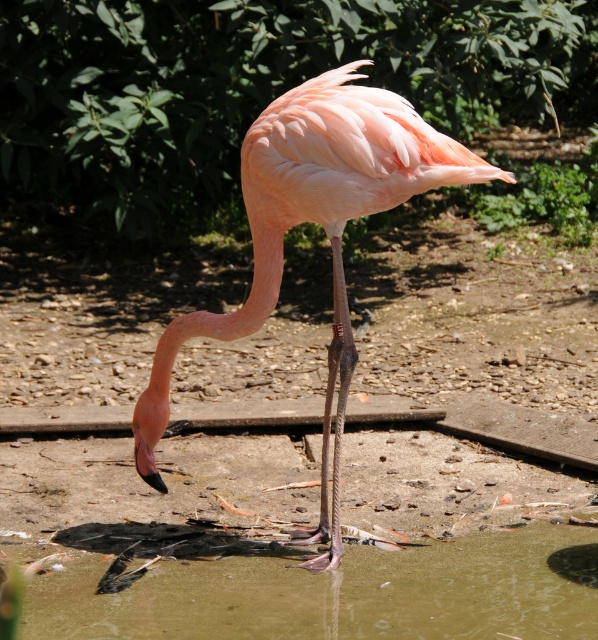
Question: Is greenish water at lower center in front of pink matte flamingo at center?

Choices:
 (A) no
 (B) yes

Answer: (B)

Question: Is greenish water at lower center wider than pink matte flamingo at center?

Choices:
 (A) no
 (B) yes

Answer: (B)

Question: Among these objects, which one is nearest to the camera?

Choices:
 (A) pink matte flamingo at center
 (B) greenish water at lower center

Answer: (B)

Question: Considering the relative positions of greenish water at lower center and pink matte flamingo at center in the image provided, where is greenish water at lower center located with respect to pink matte flamingo at center?

Choices:
 (A) left
 (B) right

Answer: (B)